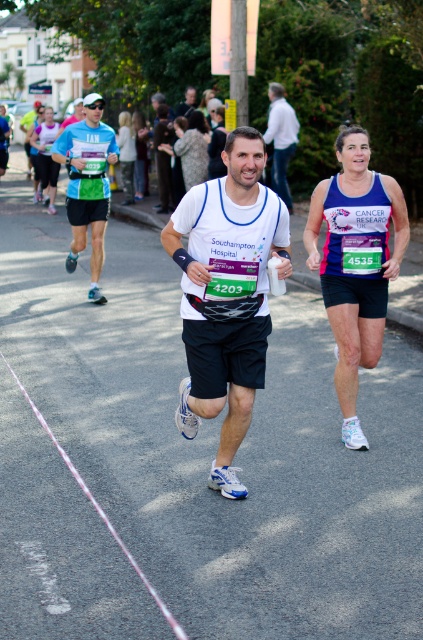
In the scene shown: You are a photographer at the marathon event. You want to take a photo of both the white matte running shirt at center and the white matte shirt at center. Which one will appear larger in your photo?

The white matte running shirt at center will appear larger in the photo because it is closer to the viewer than the white matte shirt at center.